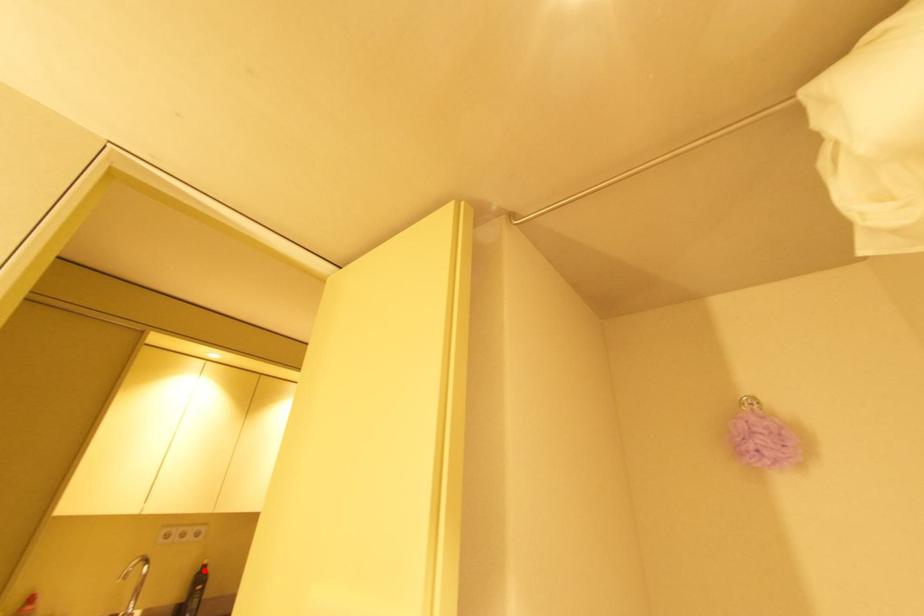
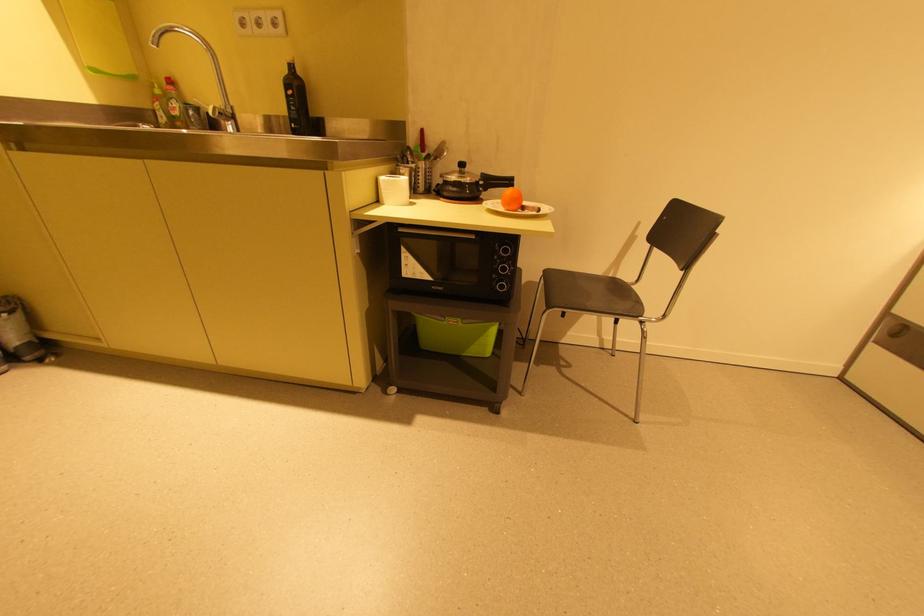
Find the pixel in the second image that matches the highlighted location in the first image.

(289, 71)